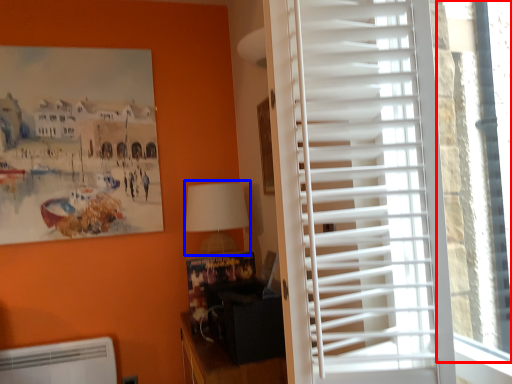
Question: Which object appears closest to the camera in this image, window screen (highlighted by a red box) or table lamp (highlighted by a blue box)?

Choices:
 (A) window screen
 (B) table lamp

Answer: (A)